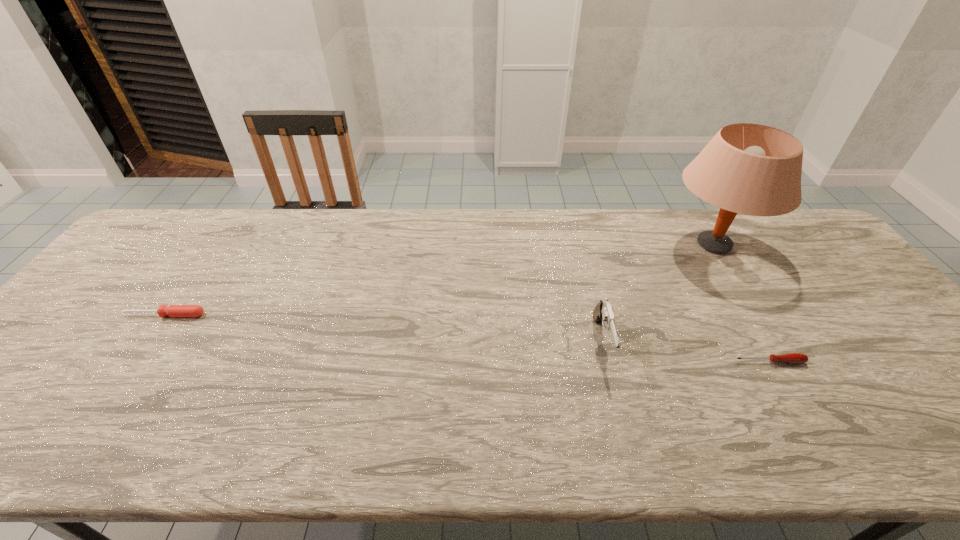
What are the coordinates of `blank region between the left screwdriver and the third shortest object` in the screenshot? It's located at (384, 328).

Image resolution: width=960 pixels, height=540 pixels. What are the coordinates of `unoccupied area between the nearer screwdriver and the leftmost object` in the screenshot? It's located at (468, 338).

Locate an element on the screen. The image size is (960, 540). vacant area that lies between the third object from right to left and the left screwdriver is located at coordinates (384, 328).

This screenshot has width=960, height=540. What are the coordinates of `free spot between the leftmost object and the tallest object` in the screenshot? It's located at (439, 280).

At what (x,y) coordinates should I click in order to perform the action: click on free spot between the right screwdriver and the lampshade. Please return your answer as a coordinate pair (x, y). The height and width of the screenshot is (540, 960). Looking at the image, I should click on (741, 303).

You are a GUI agent. You are given a task and a screenshot of the screen. Output one action in this format:
    pyautogui.click(x=<x>, y=<y>)
    Task: Click on the vacant area that lies between the gun and the tallest object
    
    Given the screenshot: What is the action you would take?
    pyautogui.click(x=658, y=293)

Where is `vacant space in between the right screwdriver and the tallest object`? vacant space in between the right screwdriver and the tallest object is located at coordinates (741, 303).

The image size is (960, 540). I want to click on free space between the gun and the nearer screwdriver, so click(686, 352).

Locate an element on the screen. The image size is (960, 540). free space between the nearer screwdriver and the second tallest object is located at coordinates (686, 352).

Select which object appears as the second closest to the gun. Please provide its 2D coordinates. Your answer should be formatted as a tuple, i.e. [(x, y)], where the tuple contains the x and y coordinates of a point satisfying the conditions above.

[(751, 169)]